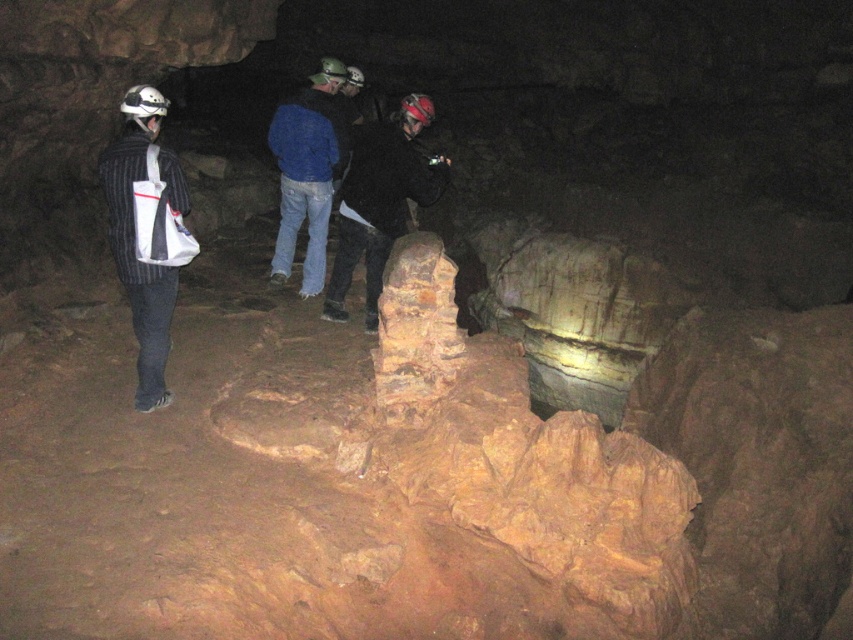
Consider the image. You are a caver who needs to place a safety marker at the point marked by the coordinates provided. Which object is located at the coordinates point (x=148, y=232)?

The point (x=148, y=232) marks the location of the striped fabric backpack at left.

You are part of the cave exploration team and need to pass through a narrow passage. You see the dark matte jacket at center and the blue denim jeans at center. Which clothing item is closer to the right side of the passage?

The dark matte jacket at center is positioned on the right side of blue denim jeans at center, so it is closer to the right side of the passage.